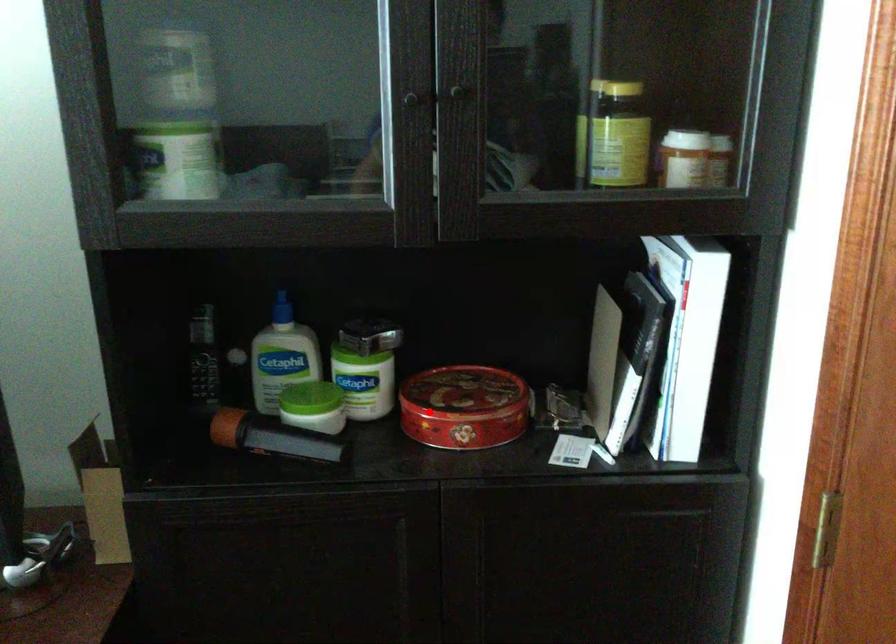
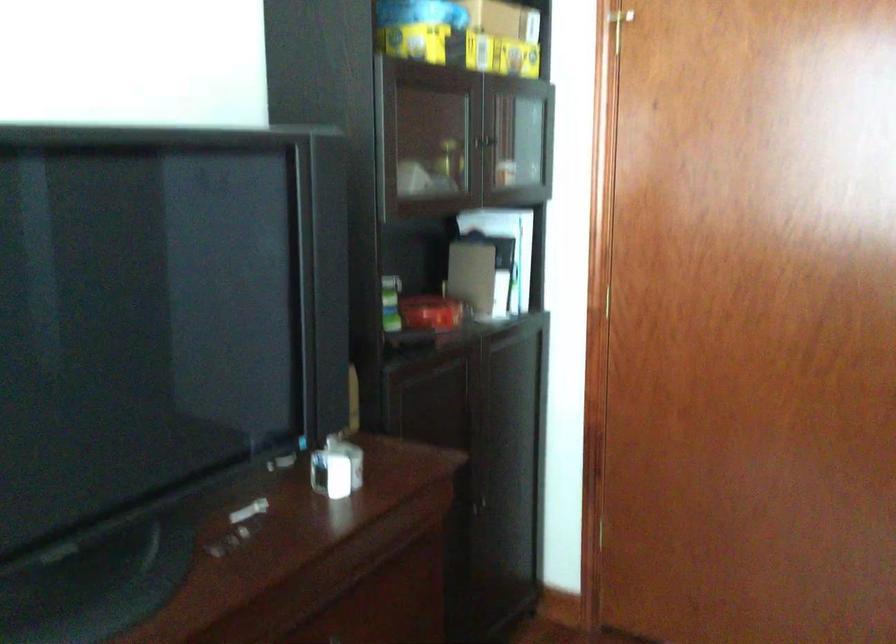
The point at the highlighted location is marked in the first image. Where is the corresponding point in the second image?

(431, 313)